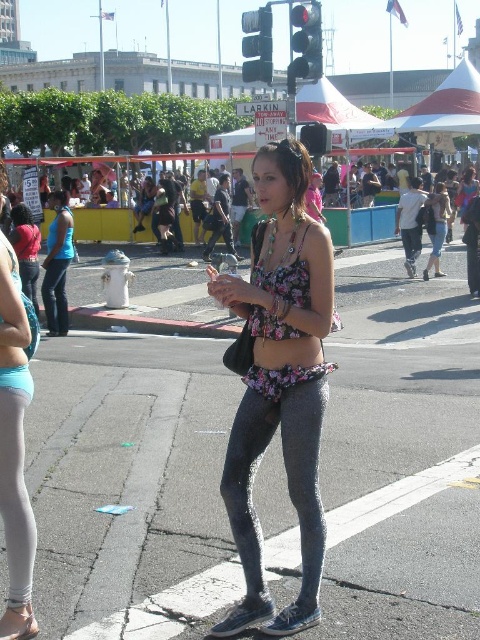
You are a city planner reviewing the street layout. You notice two traffic lights at the intersection. Which traffic light is bigger between the black plastic traffic light at upper center and the metallic traffic light at upper center?

The black plastic traffic light at upper center is larger than the metallic traffic light at upper center.

You are standing at the point with coordinates point (256, 45). What object are you standing on?

You are standing on the metallic traffic light at upper center.